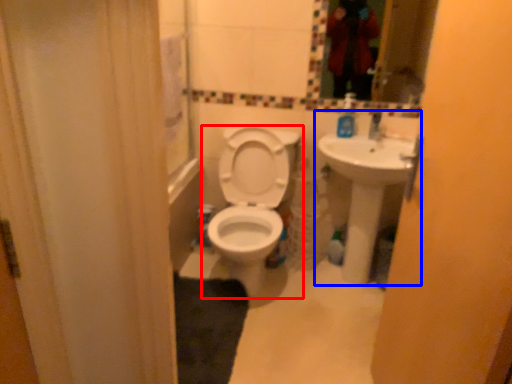
Question: Which object appears farthest to the camera in this image, toilet (highlighted by a red box) or sink (highlighted by a blue box)?

Choices:
 (A) toilet
 (B) sink

Answer: (B)